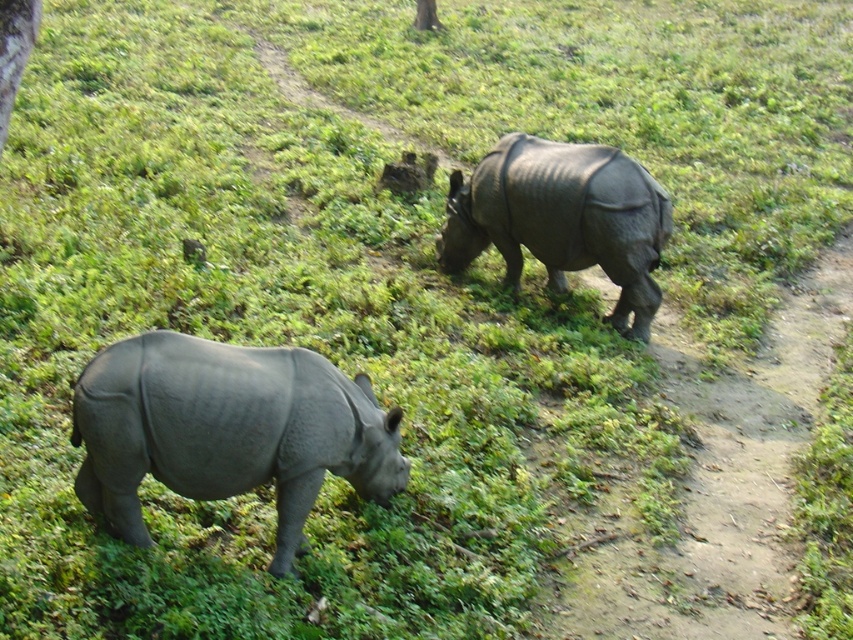
Question: Which of the following is the closest to the observer?

Choices:
 (A) gray matte rhinoceros at lower left
 (B) green leafy tree at upper left

Answer: (A)

Question: Which point is farther from the camera taking this photo?

Choices:
 (A) (253, 477)
 (B) (27, 45)
 (C) (640, 232)

Answer: (C)

Question: Which of the following is the closest to the observer?

Choices:
 (A) (16, 42)
 (B) (222, 490)

Answer: (B)

Question: Is gray matte rhinoceros at upper right further to camera compared to green leafy tree at upper left?

Choices:
 (A) no
 (B) yes

Answer: (B)

Question: Is gray matte rhinoceros at lower left to the left of green leafy tree at upper left from the viewer's perspective?

Choices:
 (A) yes
 (B) no

Answer: (B)

Question: Is gray matte rhinoceros at lower left thinner than gray matte rhinoceros at upper right?

Choices:
 (A) yes
 (B) no

Answer: (A)